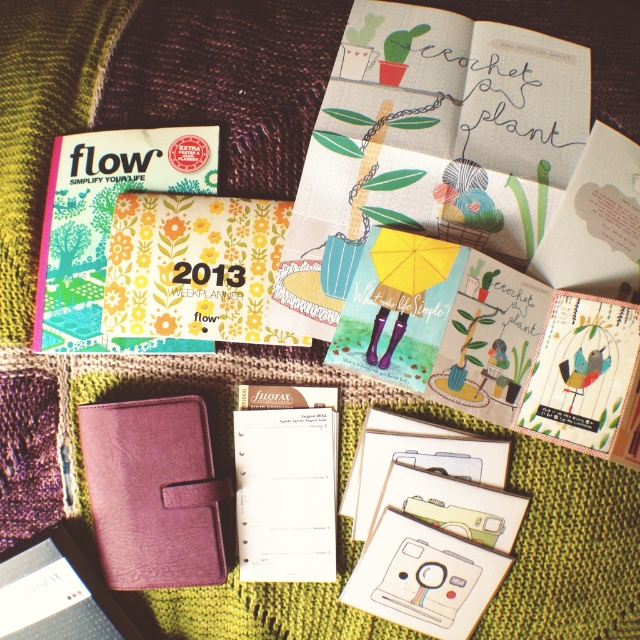
Question: Which point is farther to the camera?

Choices:
 (A) purple leather notebook at center
 (B) matte paper journal at upper center
 (C) matte floral calendar at upper left

Answer: (C)

Question: Is matte paper journal at upper center closer to the viewer compared to purple leather notebook at center?

Choices:
 (A) no
 (B) yes

Answer: (B)

Question: Does matte paper journal at upper center have a greater width compared to purple leather notebook at center?

Choices:
 (A) yes
 (B) no

Answer: (A)

Question: Among these objects, which one is nearest to the camera?

Choices:
 (A) matte floral calendar at upper left
 (B) matte paper journal at upper center
 (C) purple leather notebook at center
 (D) purple leather notepad at lower left

Answer: (B)

Question: Is matte paper journal at upper center to the left of purple leather notebook at center from the viewer's perspective?

Choices:
 (A) yes
 (B) no

Answer: (B)

Question: Which of the following is the farthest from the observer?

Choices:
 (A) purple leather notebook at center
 (B) matte paper journal at upper center
 (C) matte floral calendar at upper left

Answer: (C)